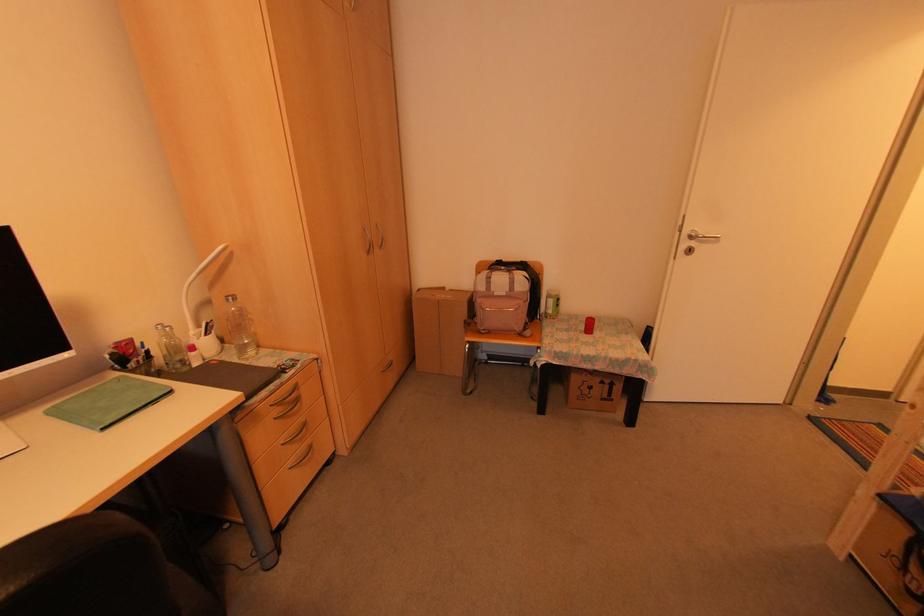
Where would you bend the white lamp neck? Please return your answer as a coordinate pair (x, y).

(201, 269)